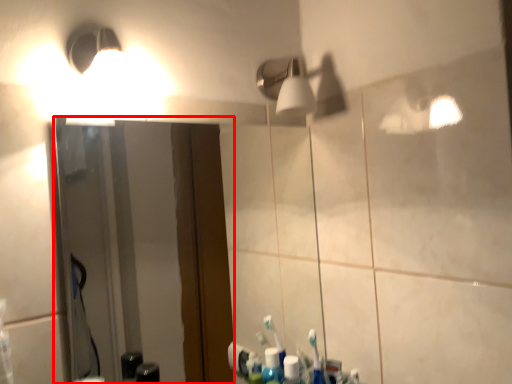
Question: Considering the relative positions of mirror (annotated by the red box) and light fixture in the image provided, where is mirror (annotated by the red box) located with respect to the staircase?

Choices:
 (A) right
 (B) left

Answer: (B)